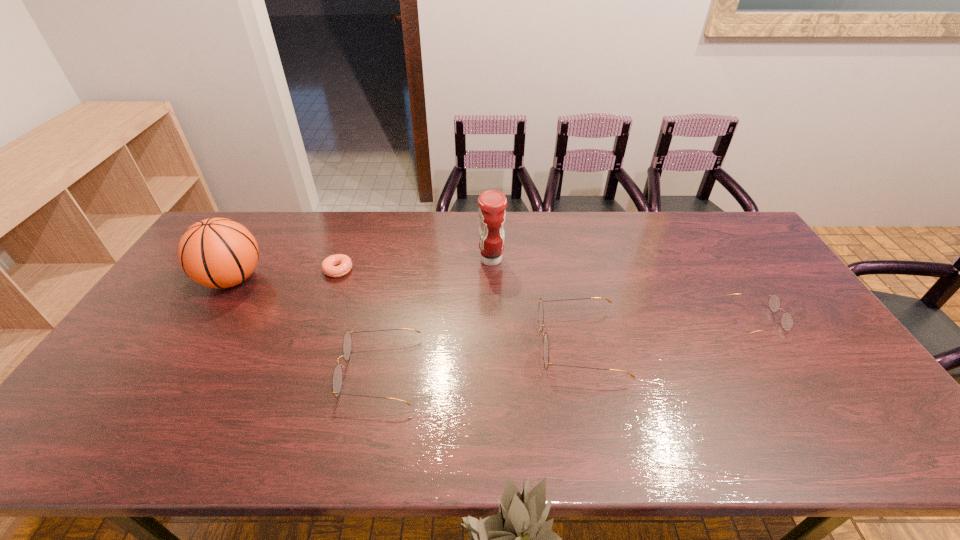
The spectacless are evenly distributed in the image. To maintain this, where would you place another spectacles on the left? Please point to a free space. Please provide its 2D coordinates. Your answer should be formatted as a tuple, i.e. [(x, y)], where the tuple contains the x and y coordinates of a point satisfying the conditions above.

[(155, 404)]